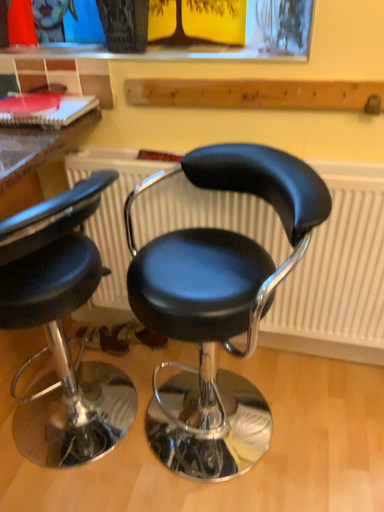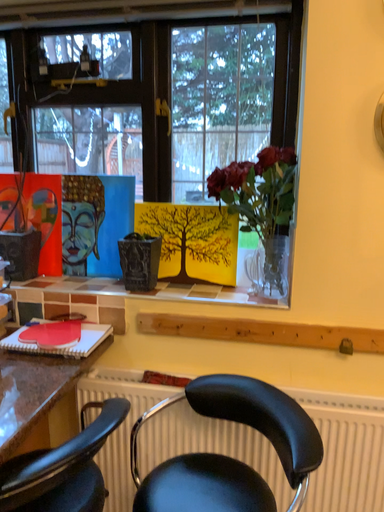
Question: How did the camera likely rotate when shooting the video?

Choices:
 (A) rotated upward
 (B) rotated downward

Answer: (A)